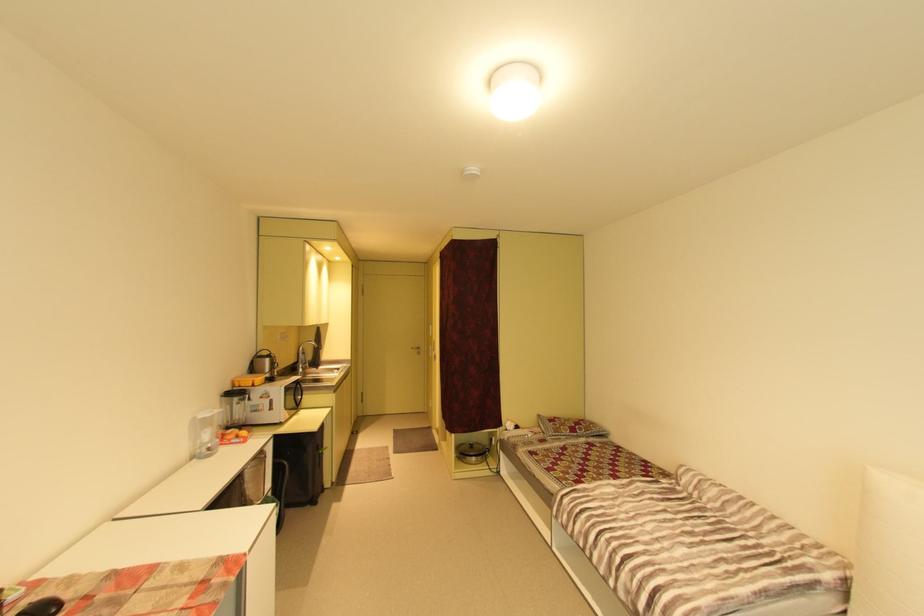
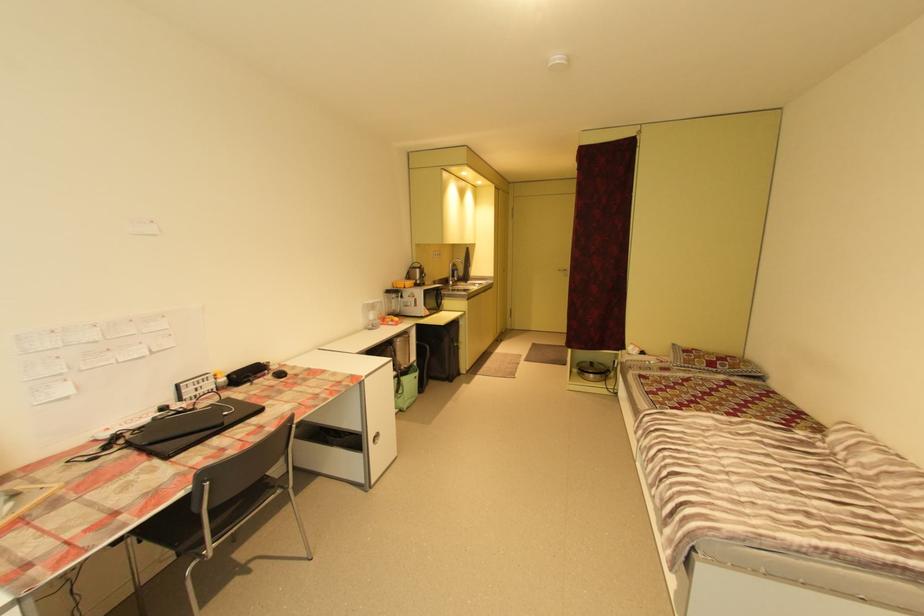
Locate, in the second image, the point that corresponds to (308,371) in the first image.

(457, 284)